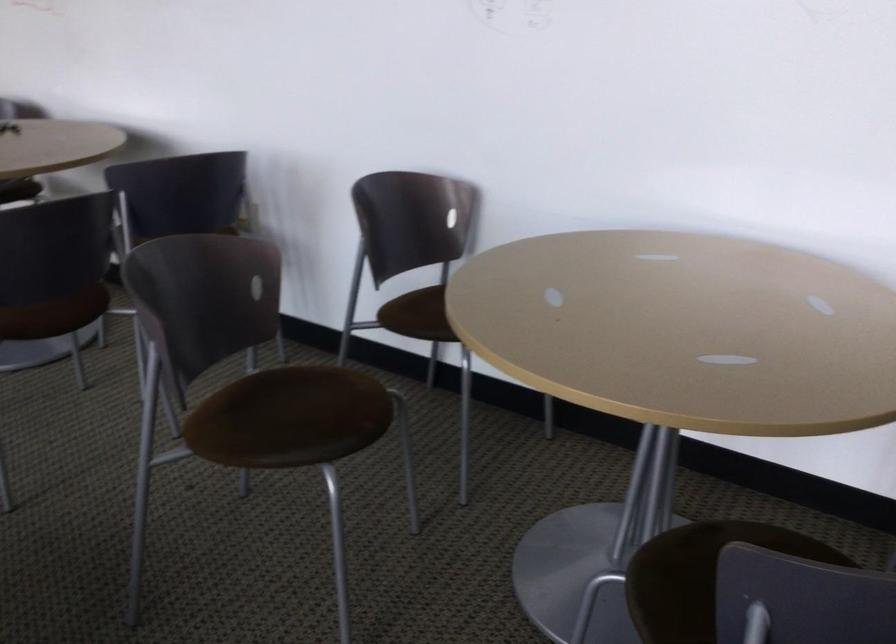
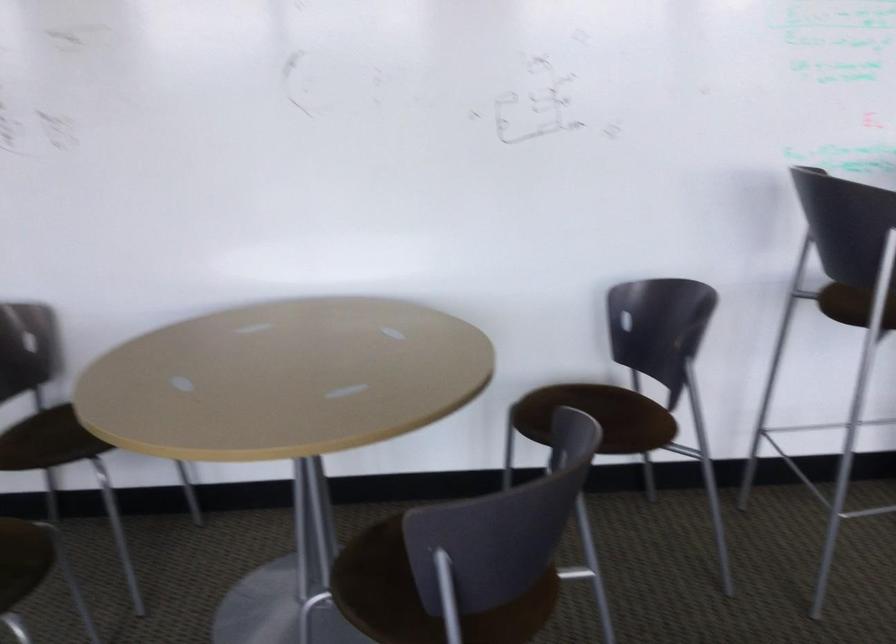
In the second image, find the point that corresponds to point 410,317 in the first image.

(26, 442)